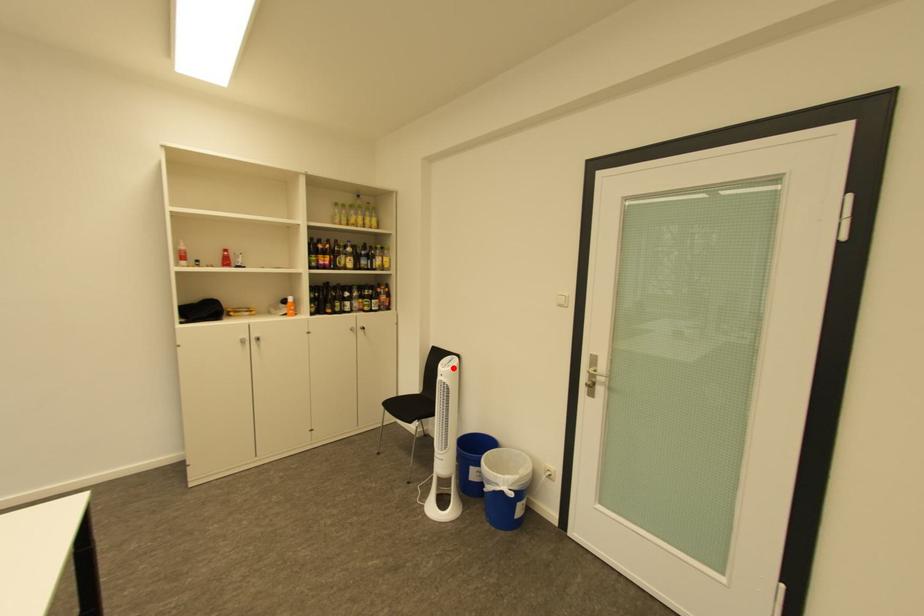
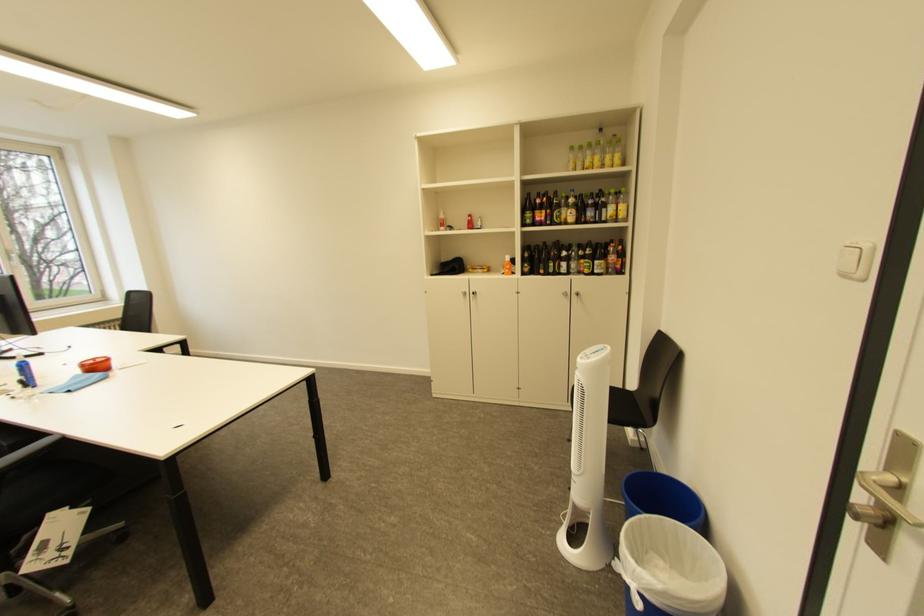
The point at the highlighted location is marked in the first image. Where is the corresponding point in the second image?

(591, 359)